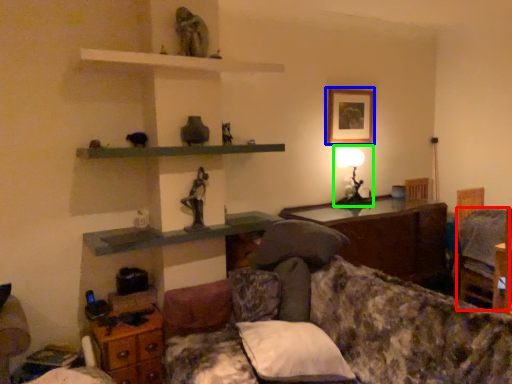
Question: Which object is positioned closest to swivel chair (highlighted by a red box)? Select from picture frame (highlighted by a blue box) and table lamp (highlighted by a green box).

Choices:
 (A) picture frame
 (B) table lamp

Answer: (B)